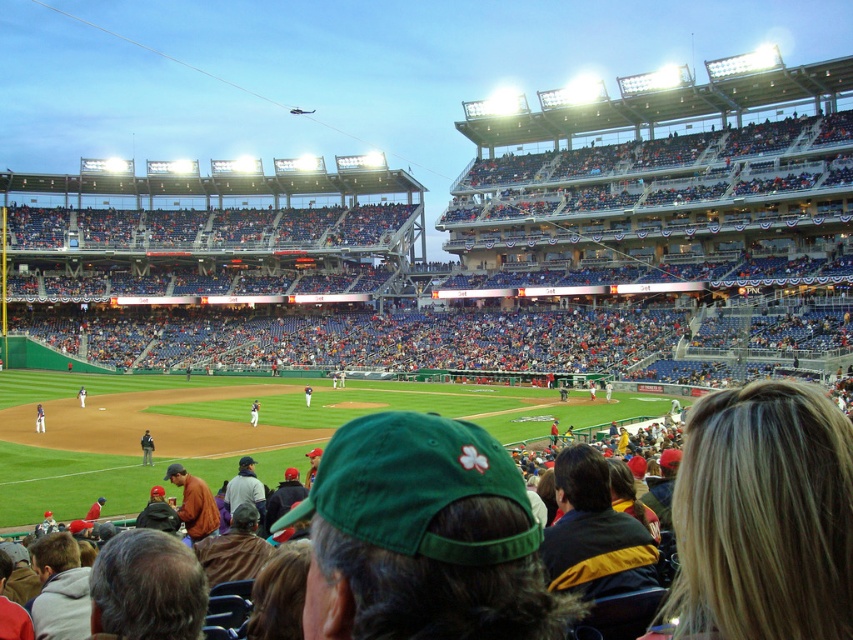
Question: Which of these objects is positioned farthest from the green fabric baseball cap at center?

Choices:
 (A) dark gray uniform at center
 (B) white jersey at center

Answer: (B)

Question: Does white jersey at center appear on the left side of green fabric baseball cap at center?

Choices:
 (A) yes
 (B) no

Answer: (A)

Question: In this image, where is white jersey at center located relative to white uniform at center?

Choices:
 (A) above
 (B) below

Answer: (B)

Question: Estimate the real-world distances between objects in this image. Which object is farther from the green fabric baseball cap at center?

Choices:
 (A) white uniform at center
 (B) dark gray uniform at center

Answer: (A)

Question: Which of the following is the closest to the observer?

Choices:
 (A) white jersey at center
 (B) green fabric baseball cap at center
 (C) white uniform at center
 (D) dark gray uniform at center

Answer: (D)

Question: Can you confirm if dark gray uniform at center is smaller than green fabric baseball cap at center?

Choices:
 (A) no
 (B) yes

Answer: (B)